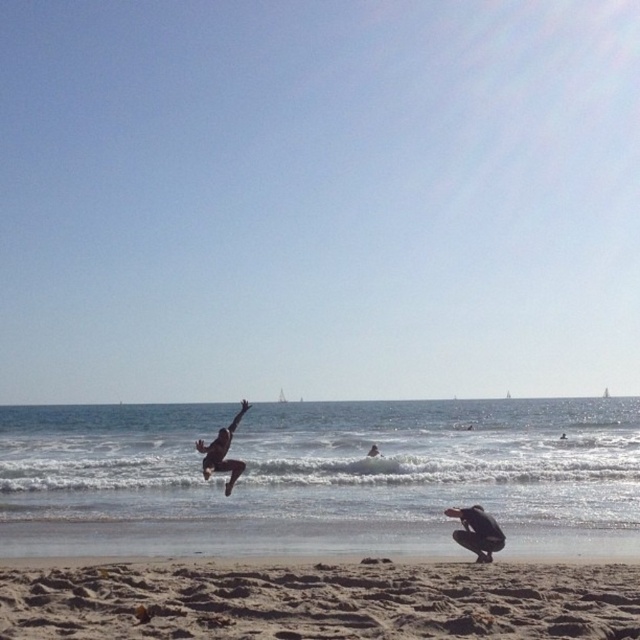
You are a photographer trying to capture the silhouette figure at center and the black matte person at lower right in the same frame. Based on their positions, which one will appear closer to the camera in the photo?

The black matte person at lower right will appear closer to the camera in the photo because they are positioned in front of the silhouette figure at center.

You are standing on the beach and want to walk to both the point at coordinates (467, 545) and the point at coordinates (221, 454). Which point will you reach first?

You will reach point (467, 545) first because it is closer to you than point (221, 454).

You are a photographer standing on the sandy beach at lower center and want to take a photo of the black matte person at lower right. Which direction should you move to frame them better?

The sandy beach at lower center is to the left of the black matte person at lower right, so you should move to the right to frame them better.